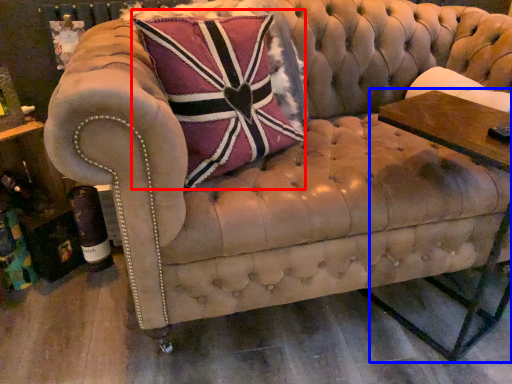
Question: Which object appears farthest to the camera in this image, throw pillow (highlighted by a red box) or side table (highlighted by a blue box)?

Choices:
 (A) throw pillow
 (B) side table

Answer: (A)